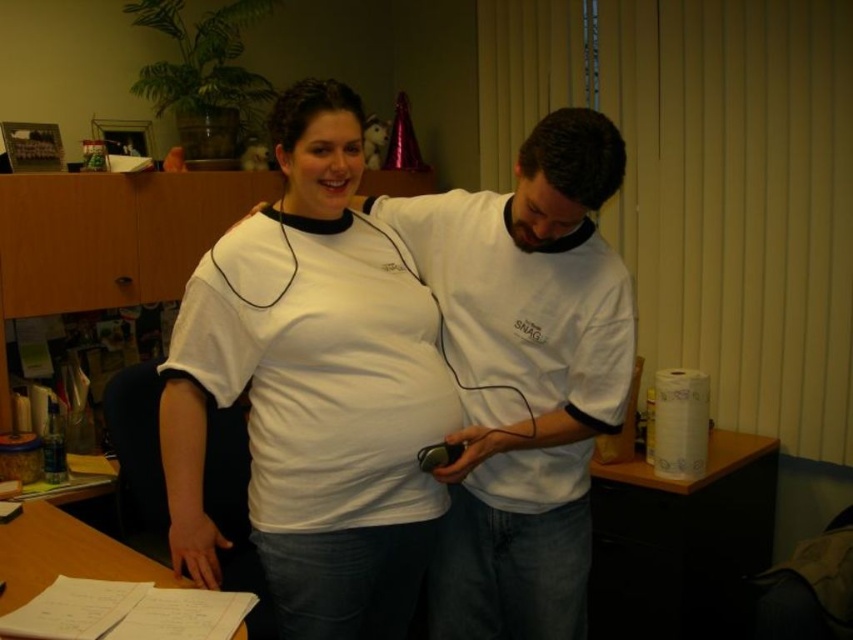
Based on the scene description, which object is bigger between the white matte shirt at center and the wooden desk at lower left?

The white matte shirt at center is larger than the wooden desk at lower left according to the description.

You are organizing a small event and need to place a decorative centerpiece on the wooden desk at lower left. However, you also have a white paper towel at right that needs to be positioned nearby. Considering their sizes, which object will require more space horizontally?

The white paper towel at right requires more horizontal space because its width is larger than that of the wooden desk at lower left.